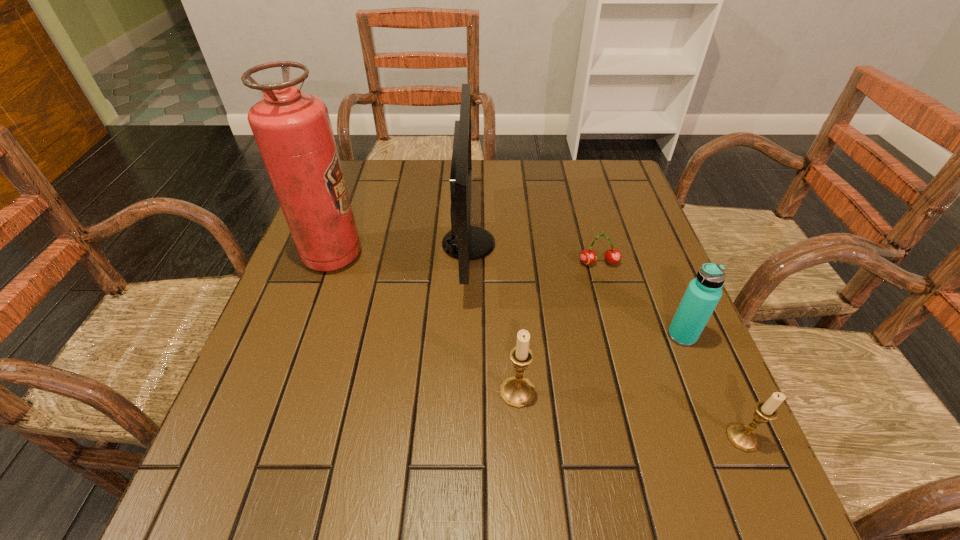
Locate an element on the screen. This screenshot has height=540, width=960. water bottle located at the right edge is located at coordinates (703, 293).

Find the location of `object that is at the near right corner`. object that is at the near right corner is located at coordinates (743, 437).

The image size is (960, 540). Find the location of `free region at the far edge of the desktop`. free region at the far edge of the desktop is located at coordinates (411, 178).

You are a GUI agent. You are given a task and a screenshot of the screen. Output one action in this format:
    pyautogui.click(x=<x>, y=<y>)
    Task: Click on the free space at the near edge of the desktop
    This screenshot has width=960, height=540.
    Given the screenshot: What is the action you would take?
    pyautogui.click(x=564, y=410)

In the image, there is a desktop. At what (x,y) coordinates should I click in order to perform the action: click on vacant region at the left edge. Please return your answer as a coordinate pair (x, y). This screenshot has width=960, height=540. Looking at the image, I should click on (314, 310).

In the image, there is a desktop. Identify the location of blank space at the right edge. (657, 397).

In order to click on vacant space at the far left corner in this screenshot , I will do `click(348, 160)`.

The image size is (960, 540). What are the coordinates of `vacant position at the near left corner of the desktop` in the screenshot? It's located at (250, 445).

Identify the location of vacant space at the far right corner of the desktop. This screenshot has width=960, height=540. (580, 168).

In the image, there is a desktop. Identify the location of free region at the near right corner. The image size is (960, 540). (x=641, y=409).